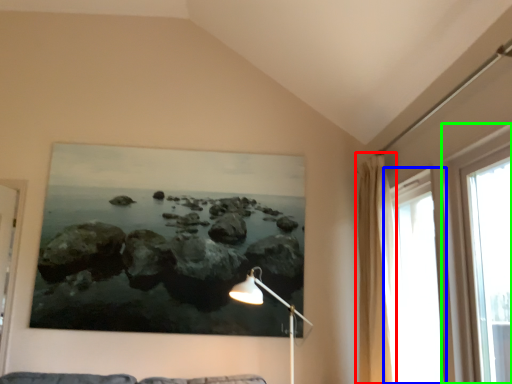
Question: Estimate the real-world distances between objects in this image. Which object is farther from curtain (highlighted by a red box), window (highlighted by a blue box) or window (highlighted by a green box)?

Choices:
 (A) window
 (B) window

Answer: (B)